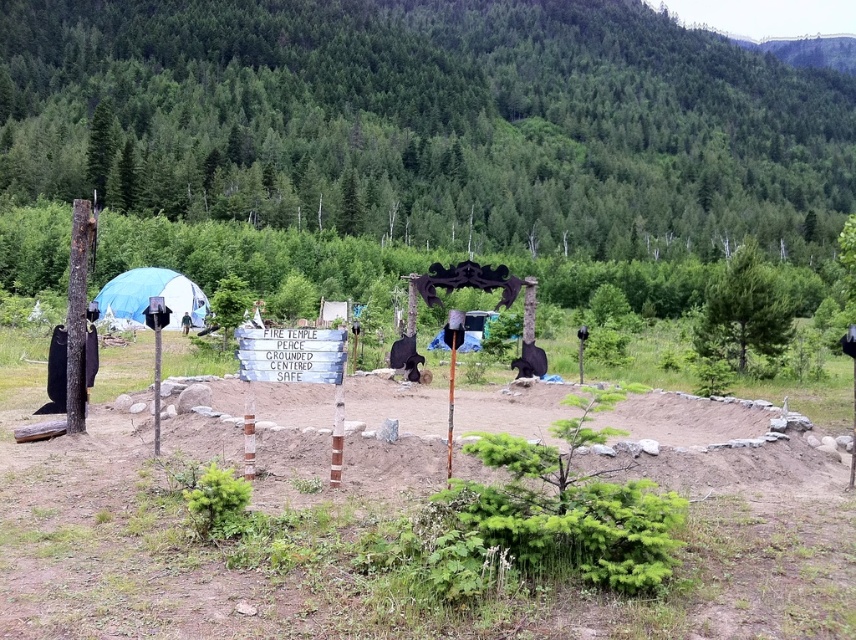
Who is more distant from viewer, (39, 560) or (450, 356)?

The point (450, 356) is behind.

At what (x,y) coordinates should I click in order to perform the action: click on dirt field at center. Please return your answer as a coordinate pair (x, y). Image resolution: width=856 pixels, height=640 pixels. Looking at the image, I should click on (378, 522).

Does point (129, 452) come farther from viewer compared to point (450, 385)?

No.

The image size is (856, 640). What are the coordinates of `dirt field at center` in the screenshot? It's located at (378, 522).

Is green leafy tree at upper center taller than white fabric tent at left?

Correct, green leafy tree at upper center is much taller as white fabric tent at left.

Is green leafy tree at upper center wider than white fabric tent at left?

Indeed, green leafy tree at upper center has a greater width compared to white fabric tent at left.

You are a GUI agent. You are given a task and a screenshot of the screen. Output one action in this format:
    pyautogui.click(x=<x>, y=<y>)
    Task: Click on the green leafy tree at upper center
    Image resolution: width=856 pixels, height=640 pixels.
    Given the screenshot: What is the action you would take?
    pyautogui.click(x=428, y=122)

Which of these two, green leafy tree at upper right or white fabric tent at left, stands shorter?

white fabric tent at left

Can you confirm if green leafy tree at upper right is positioned above white fabric tent at left?

Yes, green leafy tree at upper right is above white fabric tent at left.

This screenshot has height=640, width=856. Find the location of `green leafy tree at upper right`. green leafy tree at upper right is located at coordinates (744, 308).

This screenshot has width=856, height=640. I want to click on green leafy tree at upper right, so [x=744, y=308].